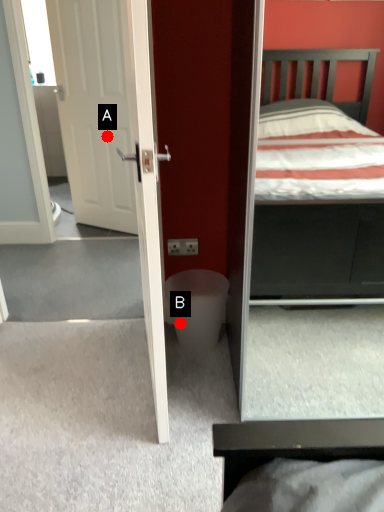
Question: Two points are circled on the image, labeled by A and B beside each circle. Which point is closer to the camera?

Choices:
 (A) A is closer
 (B) B is closer

Answer: (B)